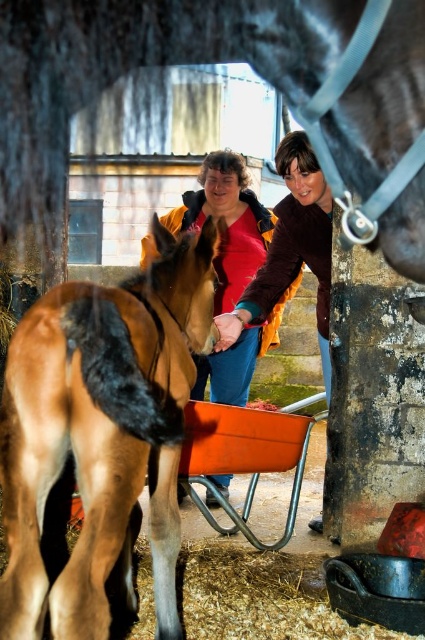
You are a photographer standing in the barn and want to take a photo of the brown glossy horse at center and the matte brown jacket at center. Which object is positioned lower in the frame?

The brown glossy horse at center is positioned lower in the frame than the matte brown jacket at center.

You are standing at the entrance of the barn and want to approach the brown glossy horse at center. According to the coordinates provided, in which direction should you move from your current position to reach the horse?

The brown glossy horse at center is located at coordinates point (x=101, y=432). Since the coordinate system typically places (x=0, y=0) at the bottom left corner and (x=424, y=639) at the top right corner, moving towards the right and slightly upwards from the entrance would lead you to the horse.